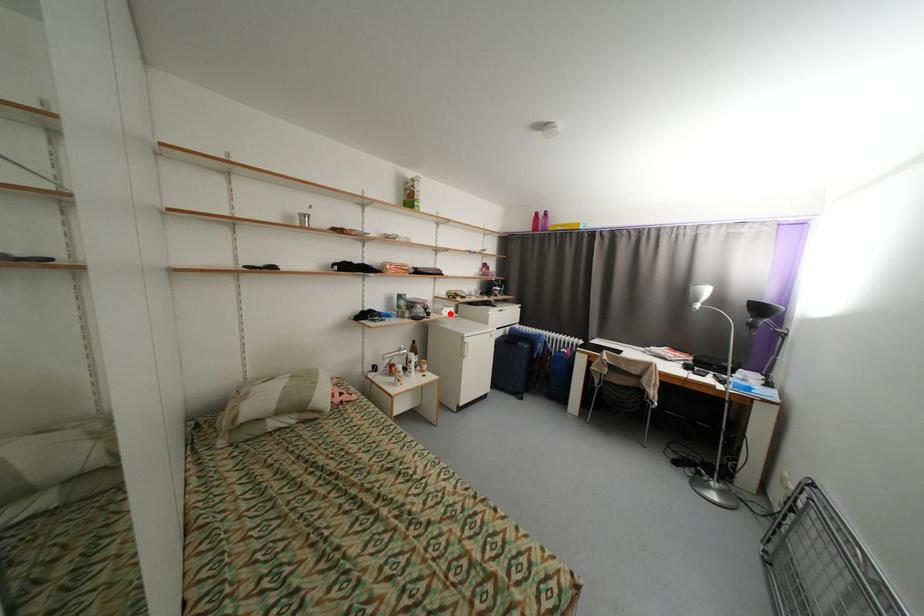
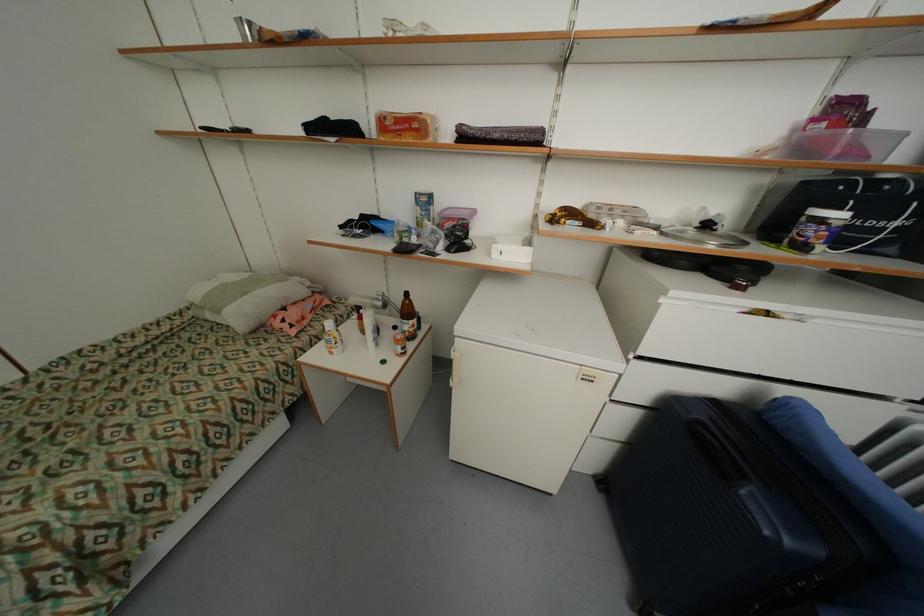
Question: I am providing you with two images of the same scene from different viewpoints. A red point is marked on the first image. At the location where the point appears in image 1, is it still visible in image 2?

Choices:
 (A) Yes
 (B) No

Answer: (A)